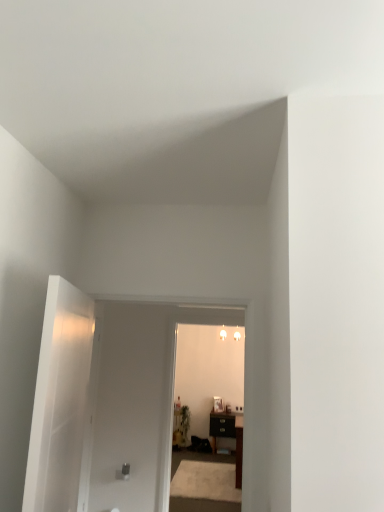
Where is `white glossy door at left`? The height and width of the screenshot is (512, 384). white glossy door at left is located at coordinates (60, 400).

What do you see at coordinates (60, 400) in the screenshot?
I see `white glossy door at left` at bounding box center [60, 400].

Where is `white glossy door at left`? The image size is (384, 512). white glossy door at left is located at coordinates (60, 400).